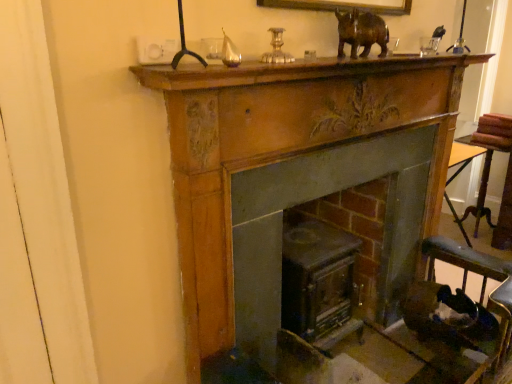
Question: From the image's perspective, relative to dark brown leather rocking chair at lower right, is smooth dark wood fireplace at center, placed as the second fireplace when sorted from right to left, above or below?

Choices:
 (A) below
 (B) above

Answer: (B)

Question: Is smooth dark wood fireplace at center, placed as the second fireplace when sorted from right to left, taller or shorter than dark brown leather rocking chair at lower right?

Choices:
 (A) tall
 (B) short

Answer: (A)

Question: Which of these objects is positioned closest to the brown polished wood rhino at upper center?

Choices:
 (A) wooden table at right
 (B) wooden mantle at upper center
 (C) wooden fireplace at center, placed as the second fireplace when sorted from left to right
 (D) smooth dark wood fireplace at center, placed as the second fireplace when sorted from right to left
 (E) dark brown leather rocking chair at lower right

Answer: (B)

Question: Considering the real-world distances, which object is closest to the wooden mantle at upper center?

Choices:
 (A) wooden fireplace at center, placed as the second fireplace when sorted from left to right
 (B) wooden table at right
 (C) dark brown leather rocking chair at lower right
 (D) smooth dark wood fireplace at center, placed as the 1th fireplace when sorted from left to right
 (E) brown polished wood rhino at upper center

Answer: (E)